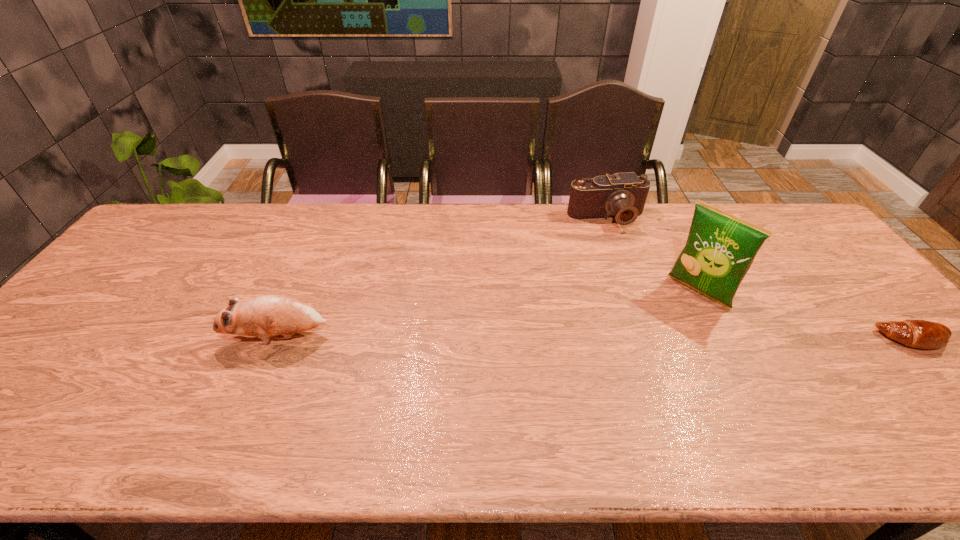
Image resolution: width=960 pixels, height=540 pixels. Find the location of `vacant position located 0.060m on the front-facing side of the camera`. vacant position located 0.060m on the front-facing side of the camera is located at coordinates (622, 244).

Locate an element on the screen. The image size is (960, 540). free location located 0.370m on the front-facing side of the camera is located at coordinates (660, 316).

Find the location of `vacant region located on the front-facing side of the camera`. vacant region located on the front-facing side of the camera is located at coordinates (637, 274).

The height and width of the screenshot is (540, 960). I want to click on object situated at the far edge, so click(622, 196).

The width and height of the screenshot is (960, 540). What are the coordinates of `free region at the far edge` in the screenshot? It's located at (442, 221).

Locate an element on the screen. This screenshot has width=960, height=540. vacant area at the near edge is located at coordinates (337, 404).

Where is `free space at the left edge of the desktop`? Image resolution: width=960 pixels, height=540 pixels. free space at the left edge of the desktop is located at coordinates (102, 327).

Locate an element on the screen. The image size is (960, 540). vacant space at the right edge is located at coordinates (823, 266).

This screenshot has width=960, height=540. I want to click on free space at the far left corner of the desktop, so click(167, 210).

At what (x,y) coordinates should I click in order to perform the action: click on free space between the camera and the crisp (potato chip). Please return your answer as a coordinate pair (x, y). The width and height of the screenshot is (960, 540). Looking at the image, I should click on (653, 255).